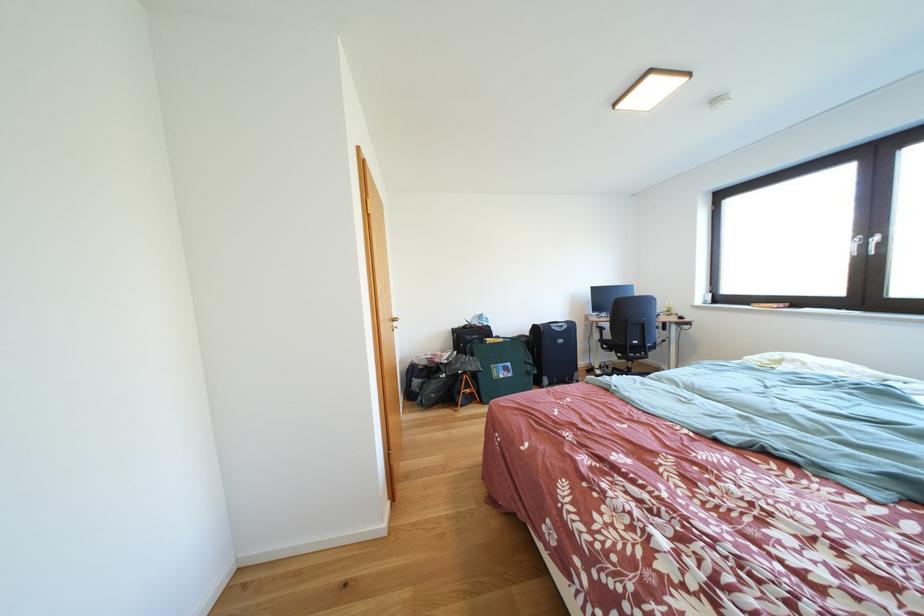
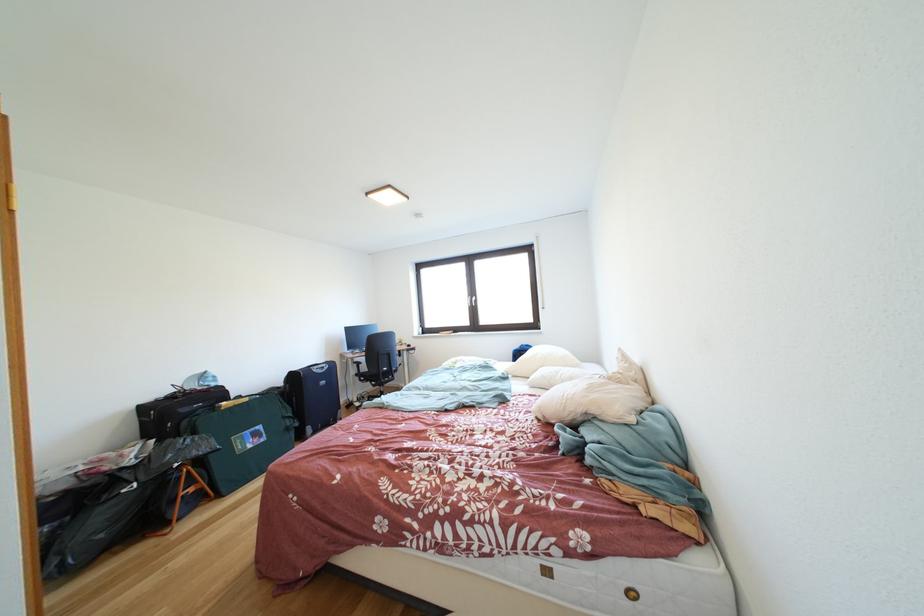
Find the pixel in the second image that matches point (493, 329) in the first image.

(222, 389)